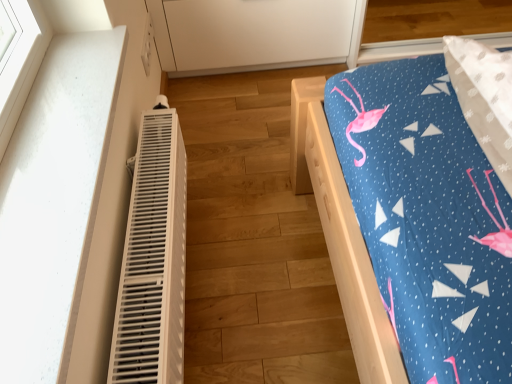
Question: Is white matte cabinet at upper center aimed at wooden bed at right?

Choices:
 (A) no
 (B) yes

Answer: (B)

Question: Is white matte cabinet at upper center closer to camera compared to wooden bed at right?

Choices:
 (A) no
 (B) yes

Answer: (A)

Question: Considering the relative sizes of white matte cabinet at upper center and wooden bed at right in the image provided, is white matte cabinet at upper center smaller than wooden bed at right?

Choices:
 (A) no
 (B) yes

Answer: (A)

Question: From a real-world perspective, is white matte cabinet at upper center under wooden bed at right?

Choices:
 (A) yes
 (B) no

Answer: (B)

Question: Is white matte cabinet at upper center bigger than wooden bed at right?

Choices:
 (A) no
 (B) yes

Answer: (B)

Question: From the image's perspective, is white matte cabinet at upper center over wooden bed at right?

Choices:
 (A) yes
 (B) no

Answer: (A)

Question: Is white plastic heater at left far away from wooden bed at right?

Choices:
 (A) yes
 (B) no

Answer: (B)

Question: Does white plastic heater at left have a lesser height compared to wooden bed at right?

Choices:
 (A) no
 (B) yes

Answer: (A)

Question: Is white plastic heater at left positioned before wooden bed at right?

Choices:
 (A) no
 (B) yes

Answer: (B)

Question: Can you confirm if white plastic heater at left is smaller than wooden bed at right?

Choices:
 (A) yes
 (B) no

Answer: (A)

Question: From the image's perspective, does white plastic heater at left appear higher than wooden bed at right?

Choices:
 (A) yes
 (B) no

Answer: (B)

Question: From the image's perspective, does white plastic heater at left appear lower than wooden bed at right?

Choices:
 (A) no
 (B) yes

Answer: (B)

Question: Does white matte cabinet at upper center have a larger size compared to white plastic heater at left?

Choices:
 (A) yes
 (B) no

Answer: (A)